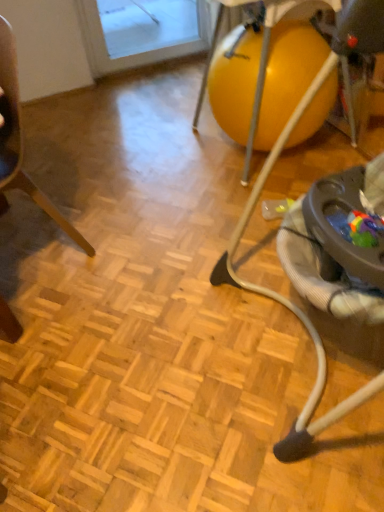
What are the coordinates of `free space in front of wooden chair at left` in the screenshot? It's located at (58, 323).